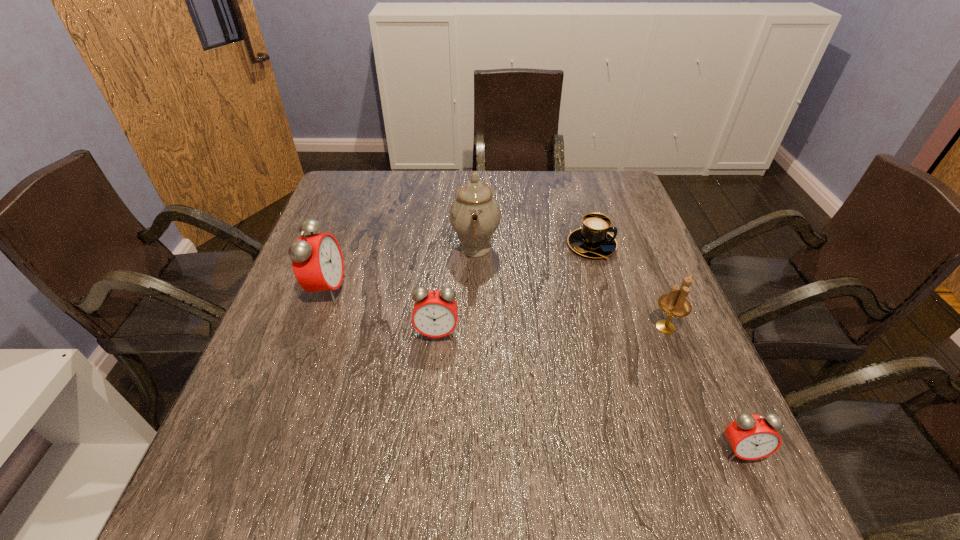
This screenshot has height=540, width=960. I want to click on the tallest alarm clock, so click(317, 261).

Identify the location of the leftmost object. [x=317, y=261].

The width and height of the screenshot is (960, 540). What are the coordinates of `the second nearest alarm clock` in the screenshot? It's located at (435, 312).

Find the location of `the second tallest alarm clock`. the second tallest alarm clock is located at coordinates (435, 312).

You are a GUI agent. You are given a task and a screenshot of the screen. Output one action in this format:
    pyautogui.click(x=<x>, y=<y>)
    Task: Click on the shortest alarm clock
    The width and height of the screenshot is (960, 540).
    Given the screenshot: What is the action you would take?
    pyautogui.click(x=751, y=437)

Identify the location of the second shortest object. (751, 437).

The image size is (960, 540). I want to click on the fourth object from left to right, so [x=592, y=240].

I want to click on the shortest object, so click(x=592, y=240).

What are the coordinates of `the tallest object` in the screenshot? It's located at (475, 215).

Locate an element on the screen. The image size is (960, 540). candle holder is located at coordinates (675, 304).